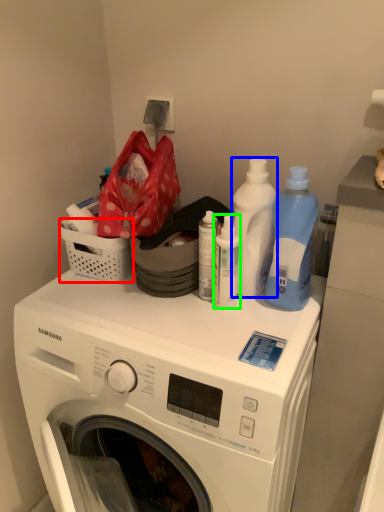
Question: Considering the real-world distances, which object is farthest from basket (highlighted by a red box)? cleaning product (highlighted by a blue box) or cleaning product (highlighted by a green box)?

Choices:
 (A) cleaning product
 (B) cleaning product

Answer: (A)